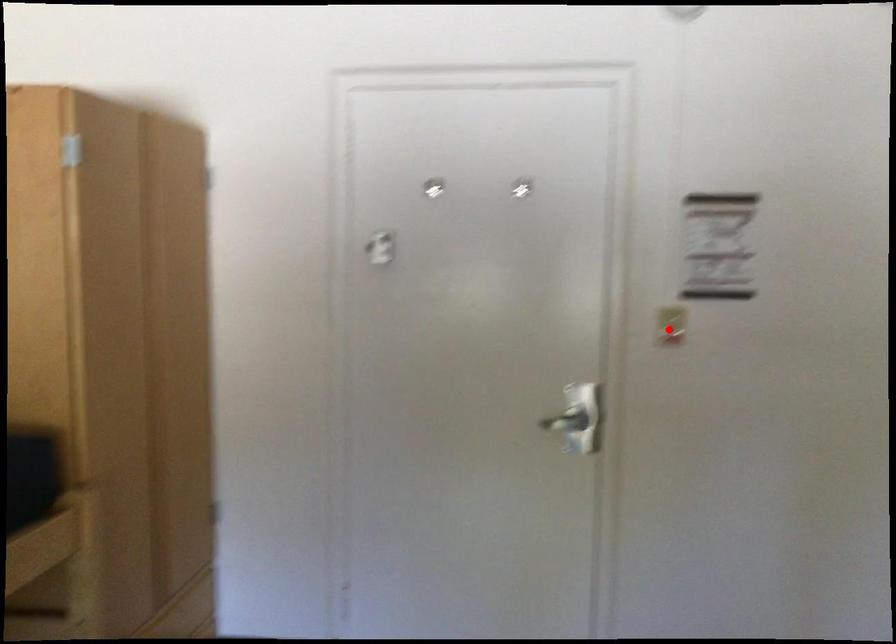
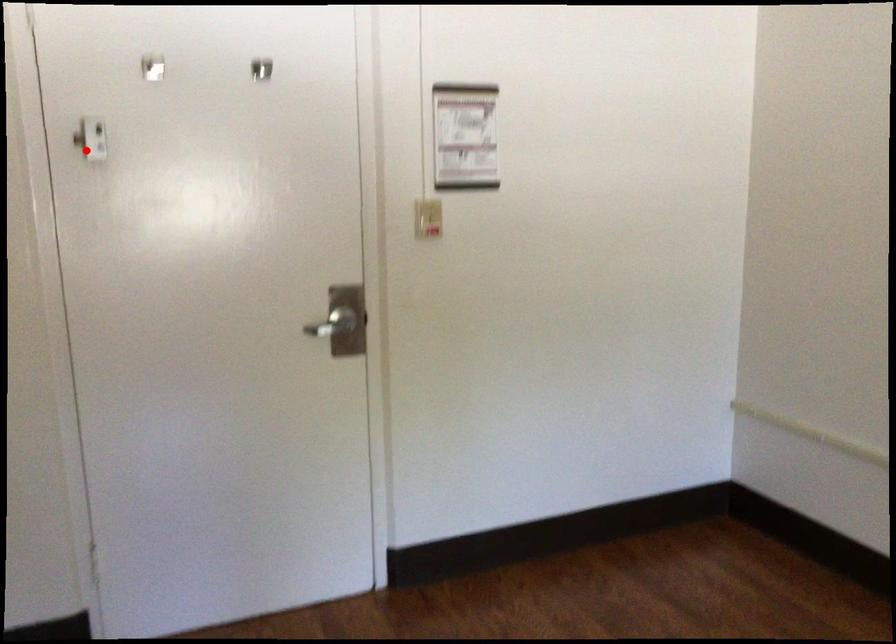
I am providing you with two images of the same scene from different viewpoints. A red point is marked on the first image and another point is marked on the second image. Does the point marked in image1 correspond to the same location as the one in image2?

No